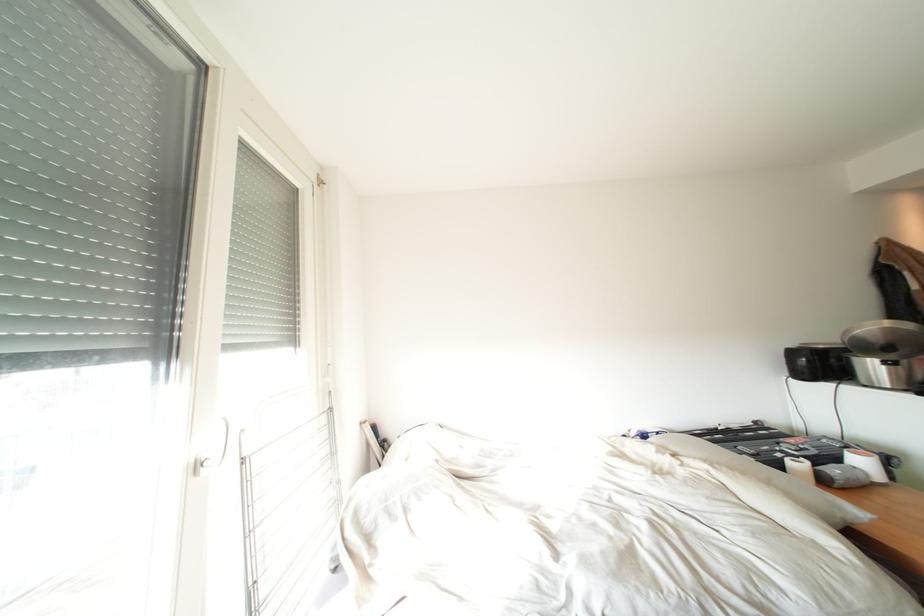
Find where to lift the black lid handle. Please return your answer as a coordinate pair (x, y).

(889, 346)